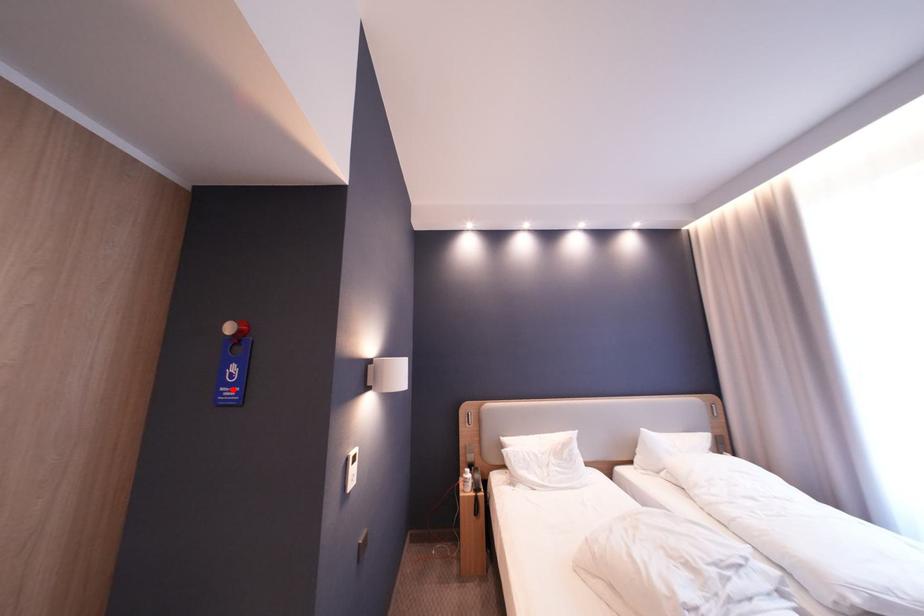
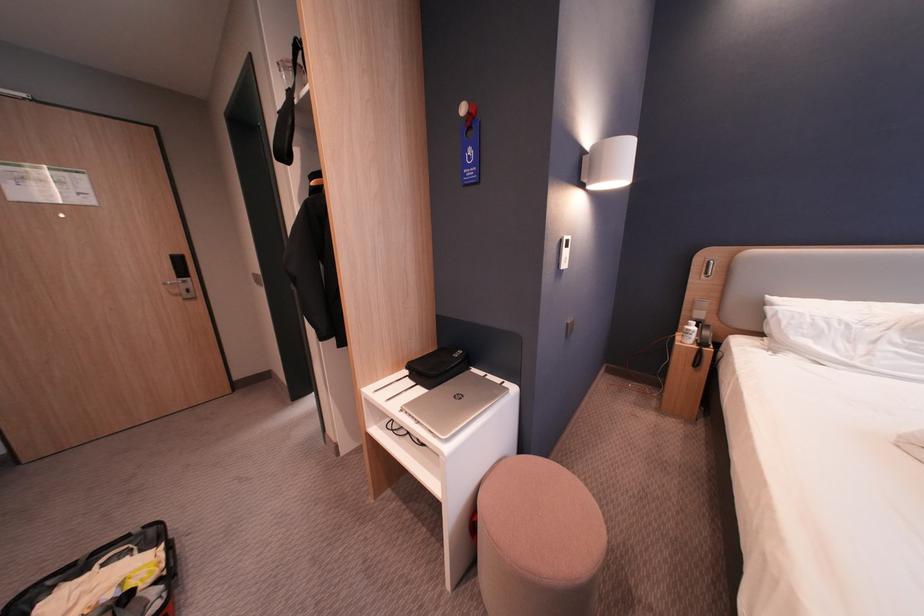
In the second image, find the point that corresponds to the highlighted location in the first image.

(477, 172)